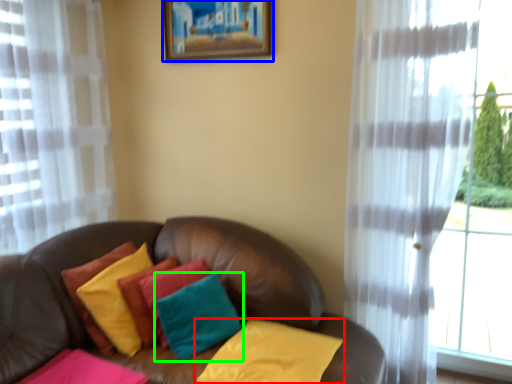
Question: Which is nearer to the pillow (highlighted by a red box)? picture frame (highlighted by a blue box) or pillow (highlighted by a green box).

Choices:
 (A) picture frame
 (B) pillow

Answer: (B)